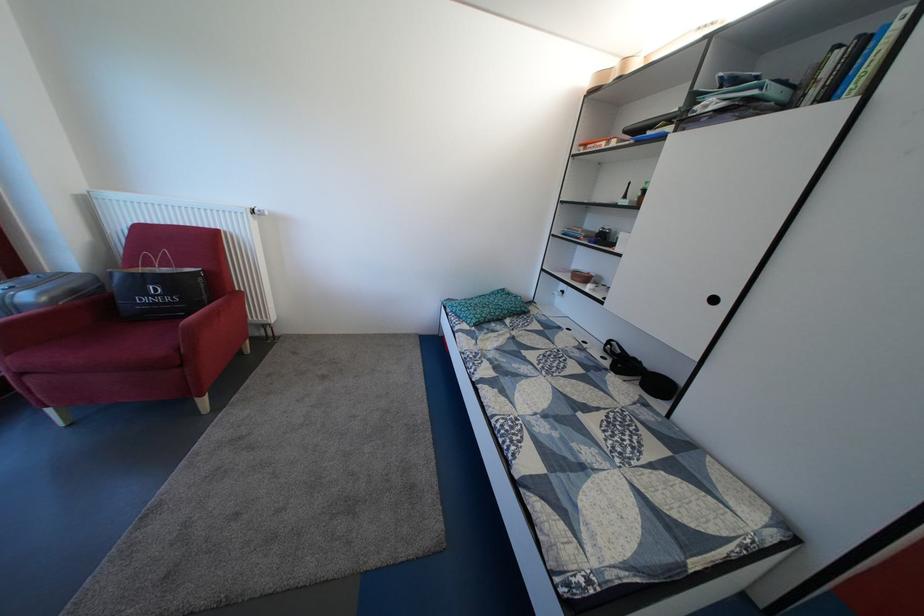
The location [580,276] corresponds to which object?

It refers to a brown ceramic bowl.